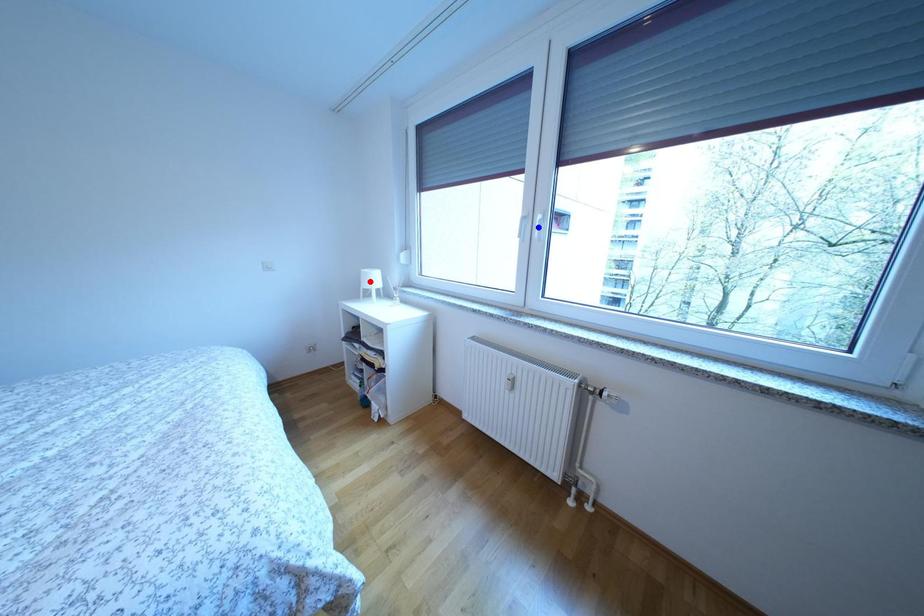
Question: Which of the two points in the image is closer to the camera?

Choices:
 (A) Blue point is closer.
 (B) Red point is closer.

Answer: (A)